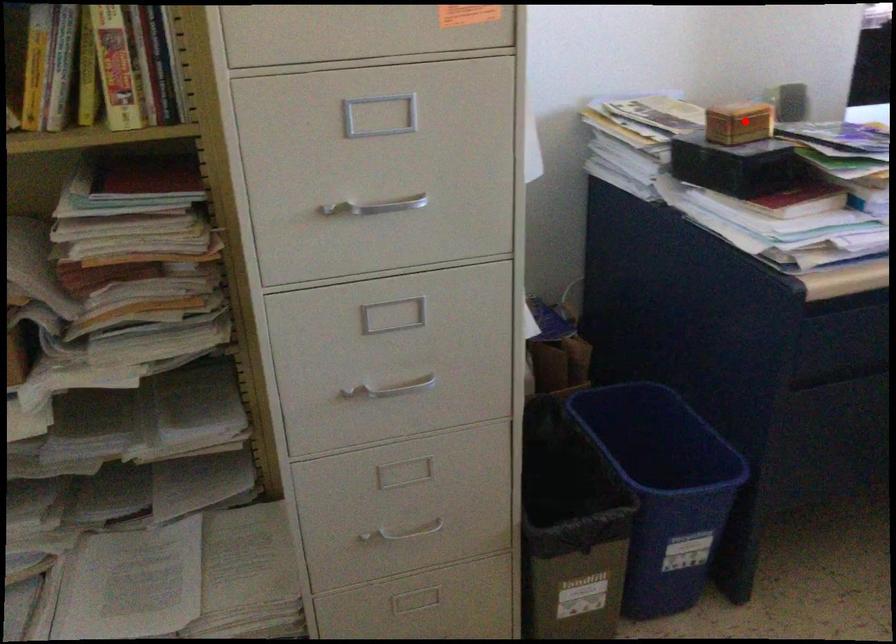
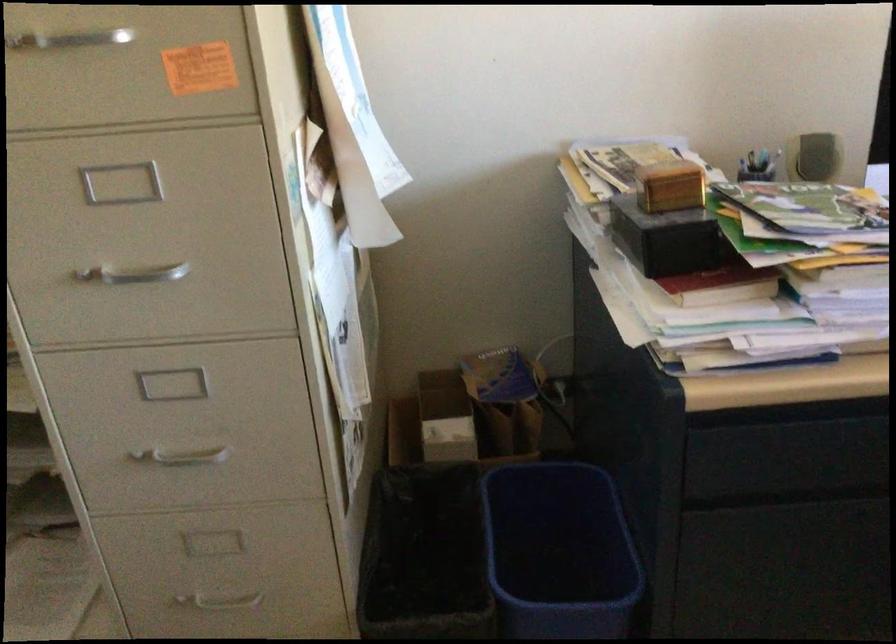
The point at the highlighted location is marked in the first image. Where is the corresponding point in the second image?

(669, 185)